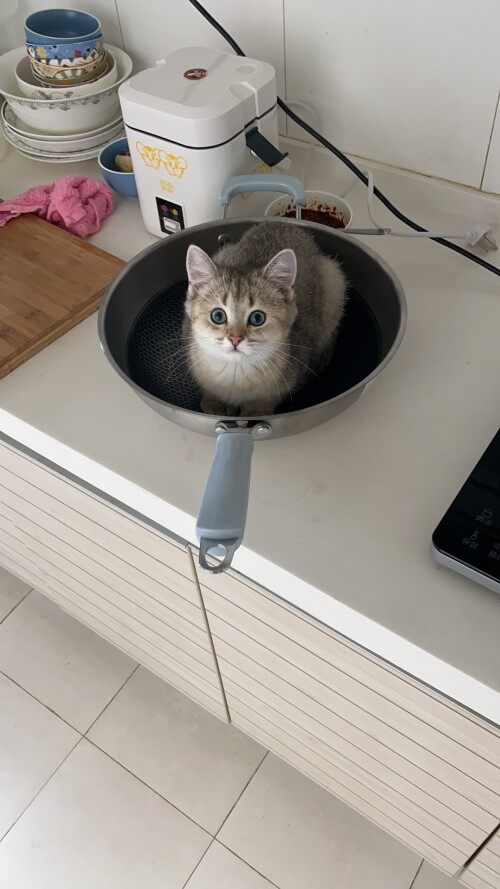
The image size is (500, 889). Identify the location of cabinet/drawers. (87, 572), (316, 633), (420, 774), (414, 825).